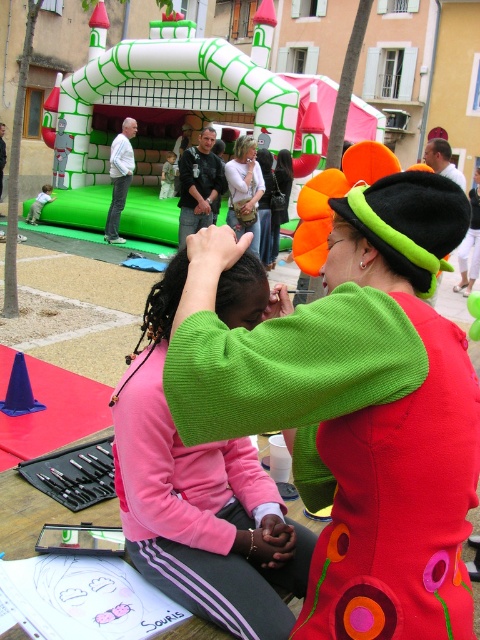
Is point (227, 220) positioned after point (283, 168)?

No.

Is matte pink hoodie at center to the left of matte black hair at center from the viewer's perspective?

Indeed, matte pink hoodie at center is positioned on the left side of matte black hair at center.

Between point (256, 218) and point (284, 182), which one is positioned behind?

Positioned behind is point (284, 182).

Locate an element on the screen. This screenshot has width=480, height=640. matte pink hoodie at center is located at coordinates (244, 189).

Is pink fleece jacket at center wider than matte black hair at center?

Yes, pink fleece jacket at center is wider than matte black hair at center.

Is point (156, 332) farther from viewer compared to point (284, 193)?

No, (156, 332) is in front of (284, 193).

Locate an element on the screen. pink fleece jacket at center is located at coordinates (200, 499).

Between fluorescent green felt hat at center and matte pink hoodie at center, which one is positioned higher?

Positioned higher is matte pink hoodie at center.

Is point (348, 230) positioned behind point (235, 193)?

No.

The width and height of the screenshot is (480, 640). I want to click on fluorescent green felt hat at center, so click(x=355, y=406).